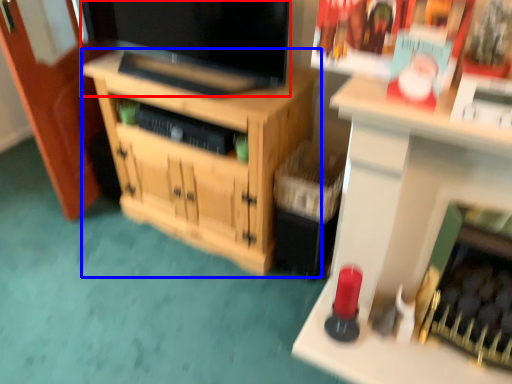
Question: Which object is further to the camera taking this photo, television (highlighted by a red box) or cabinetry (highlighted by a blue box)?

Choices:
 (A) television
 (B) cabinetry

Answer: (B)